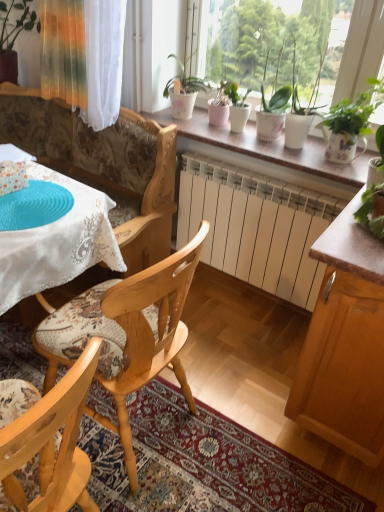
I want to click on empty space that is ontop of wooden placemat at lower center (from a real-world perspective), so 199,462.